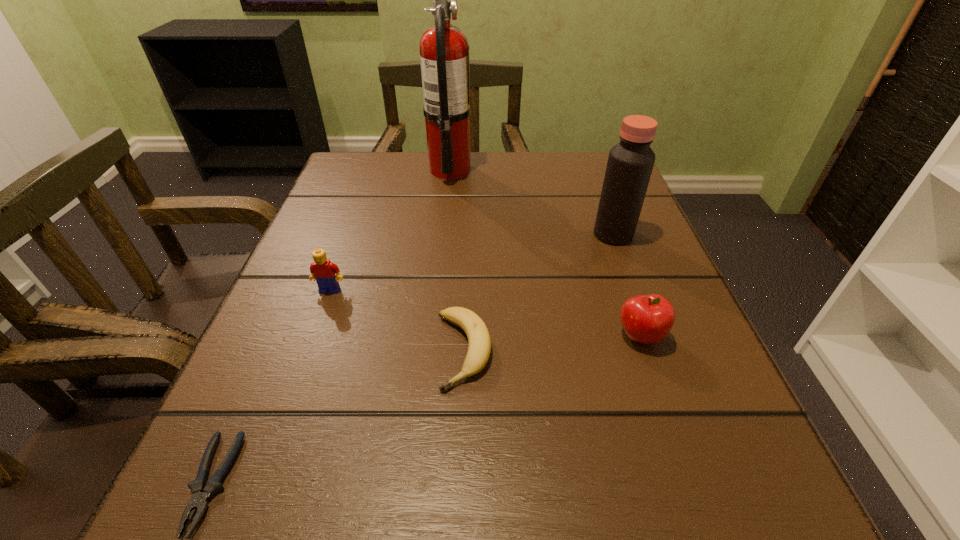
Where is `vacant space at the far left corner`? This screenshot has width=960, height=540. vacant space at the far left corner is located at coordinates (349, 156).

This screenshot has width=960, height=540. I want to click on vacant area at the far right corner, so click(x=584, y=158).

The image size is (960, 540). What are the coordinates of `free spot between the apple and the fifth shortest object` in the screenshot? It's located at (627, 286).

Find the location of a particular element. The image size is (960, 540). empty location between the banana and the fourth nearest object is located at coordinates (x=396, y=320).

Locate an element on the screen. Image resolution: width=960 pixels, height=540 pixels. free space between the second tallest object and the fifth tallest object is located at coordinates (539, 292).

Where is `empty space between the apple and the banana`? The width and height of the screenshot is (960, 540). empty space between the apple and the banana is located at coordinates (552, 343).

The width and height of the screenshot is (960, 540). In order to click on free space between the second shortest object and the fire extinguisher in this screenshot , I will do `click(457, 260)`.

Locate an element on the screen. Image resolution: width=960 pixels, height=540 pixels. free space between the apple and the farthest object is located at coordinates (545, 253).

Locate an element on the screen. The height and width of the screenshot is (540, 960). object that ranks as the fifth closest to the banana is located at coordinates (444, 57).

Identify the location of the closest object to the second shortest object. (322, 269).